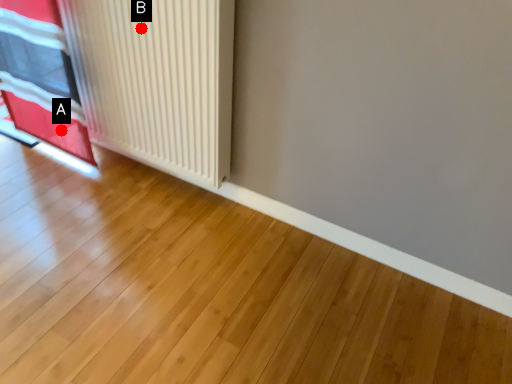
Question: Two points are circled on the image, labeled by A and B beside each circle. Which point is closer to the camera?

Choices:
 (A) A is closer
 (B) B is closer

Answer: (B)